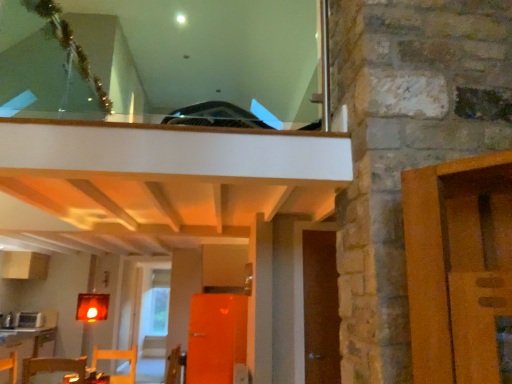
Question: From the image's perspective, relative to wooden chair at lower left, is wooden table at lower left, placed as the first table when sorted from back to front, above or below?

Choices:
 (A) above
 (B) below

Answer: (B)

Question: In the image, is wooden table at lower left, placed as the first table when sorted from back to front, positioned in front of or behind wooden chair at lower left?

Choices:
 (A) behind
 (B) front

Answer: (A)

Question: Estimate the real-world distances between objects in this image. Which object is closer to the wooden table at lower left, placed as the 1th table when sorted from front to back?

Choices:
 (A) wooden chair at lower left
 (B) wooden table at lower left, the second table positioned from the top
 (C) brown wooden door at right
 (D) white glossy microwave at lower left

Answer: (A)

Question: Which is farther from the brown wooden door at right?

Choices:
 (A) wooden table at lower left, the 2th table when ordered from right to left
 (B) white glossy microwave at lower left
 (C) wooden table at lower left, which is counted as the second table, starting from the back
 (D) wooden chair at lower left

Answer: (B)